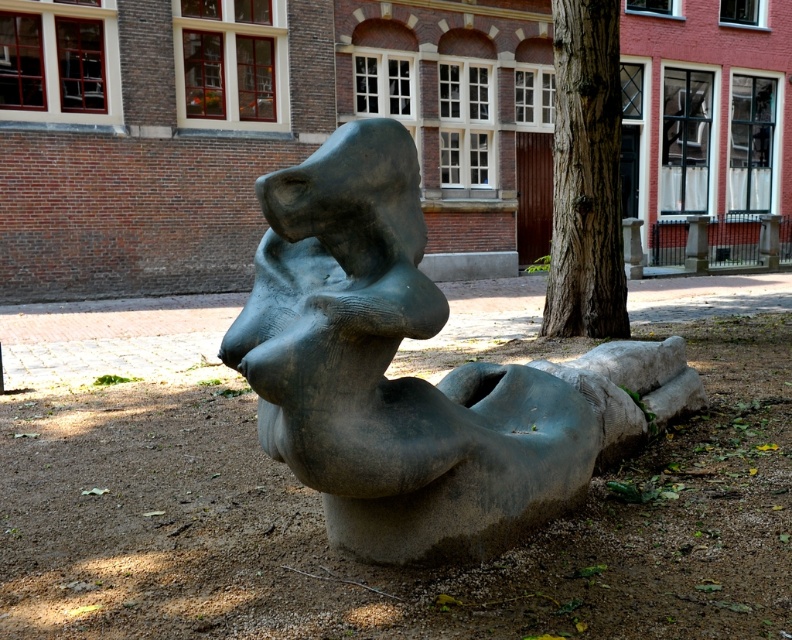
Question: Which of the following is the farthest from the observer?

Choices:
 (A) matte gray stone sculpture at center
 (B) smooth brown tree trunk at center

Answer: (B)

Question: Observing the image, what is the correct spatial positioning of matte gray stone sculpture at center in reference to smooth brown tree trunk at center?

Choices:
 (A) left
 (B) right

Answer: (A)

Question: Is matte gray stone sculpture at center above smooth brown tree trunk at center?

Choices:
 (A) no
 (B) yes

Answer: (A)

Question: Does matte gray stone sculpture at center appear on the right side of smooth brown tree trunk at center?

Choices:
 (A) no
 (B) yes

Answer: (A)

Question: Which point is farther to the camera?

Choices:
 (A) smooth brown tree trunk at center
 (B) matte gray stone sculpture at center

Answer: (A)